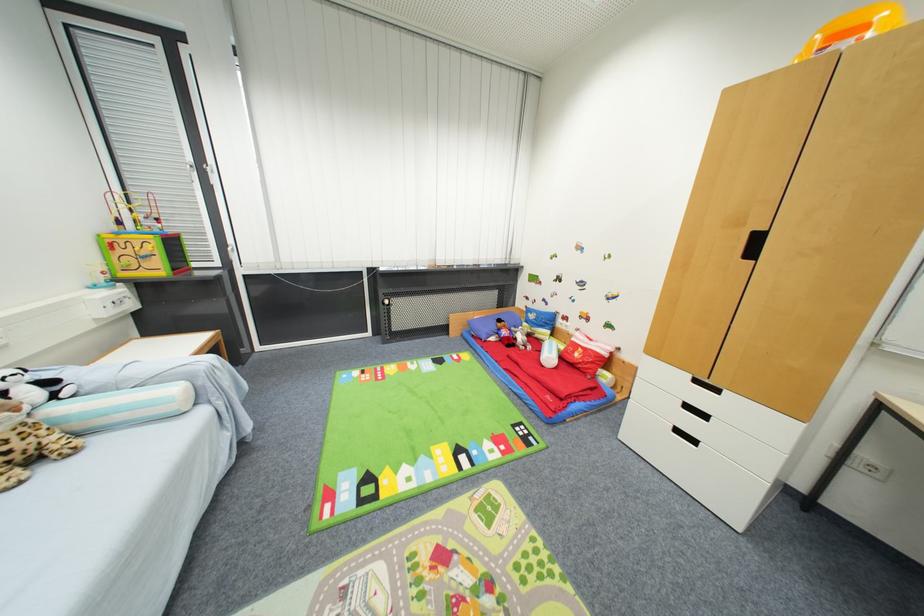
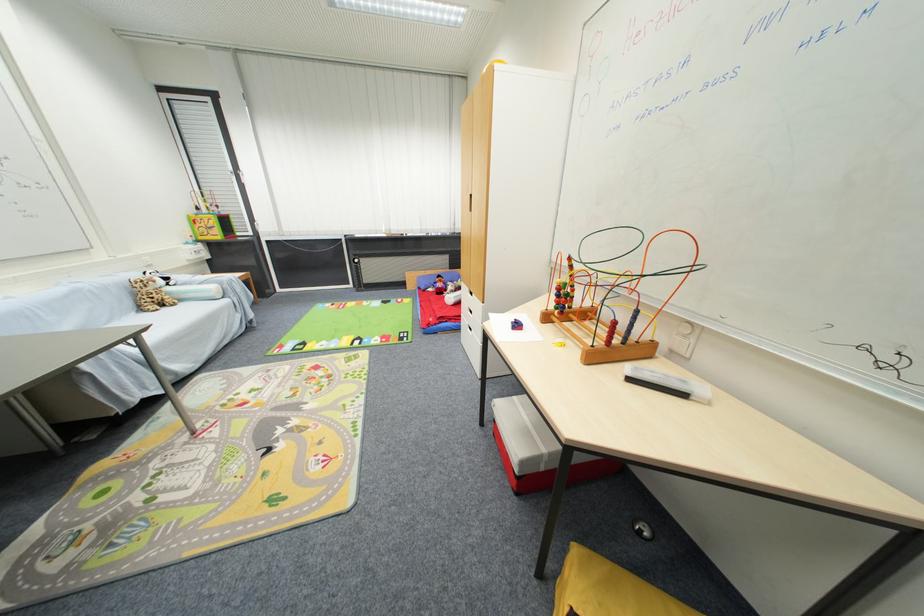
Locate, in the second image, the point that corresponds to point 52,471 in the first image.

(171, 310)